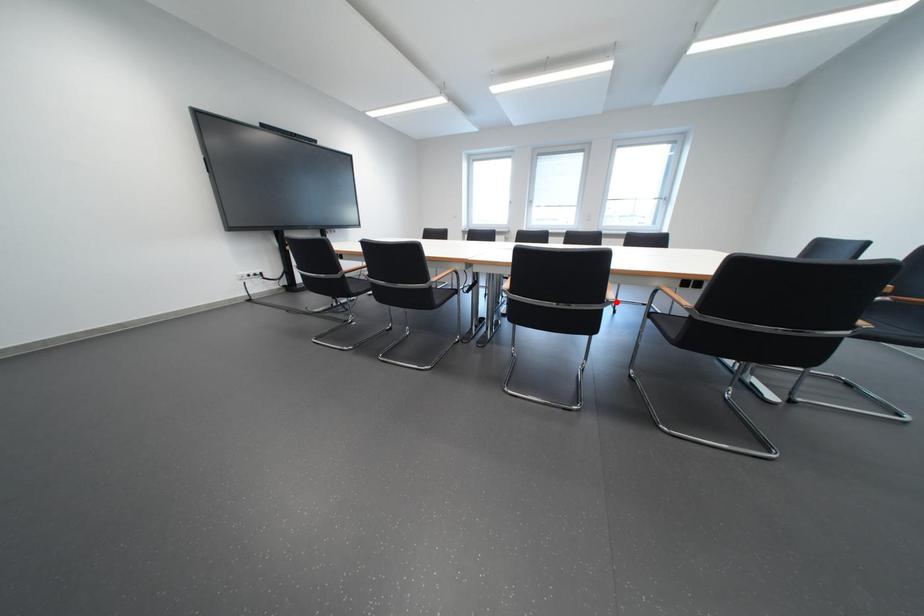
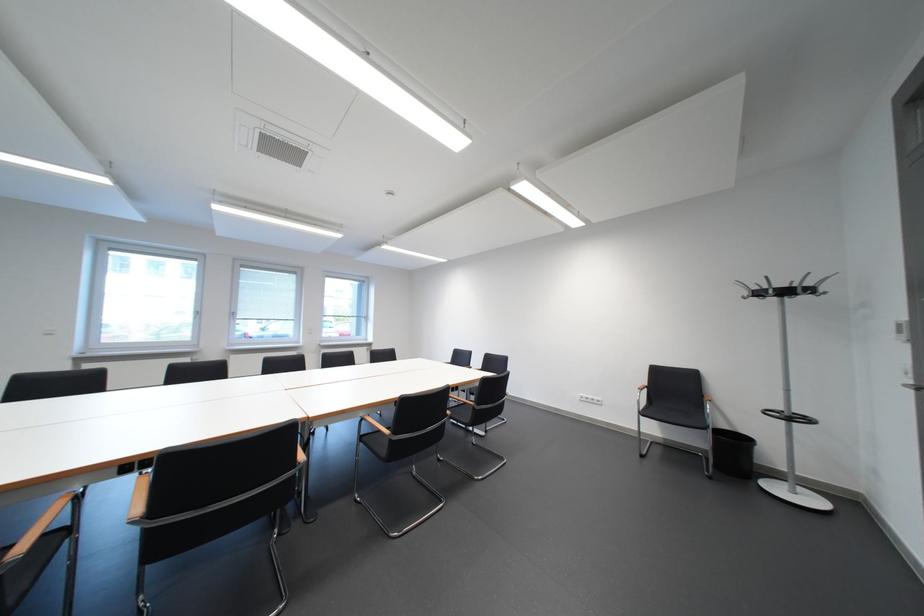
Find the pixel in the second image that matches the highlighted location in the first image.

(459, 416)